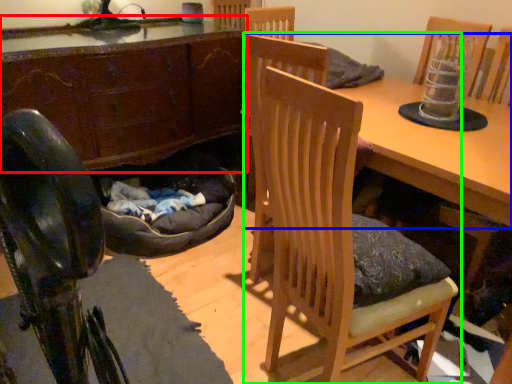
Question: Which object is positioned closest to cabinetry (highlighted by a red box)? Select from table (highlighted by a blue box) and chair (highlighted by a green box).

Choices:
 (A) table
 (B) chair

Answer: (B)